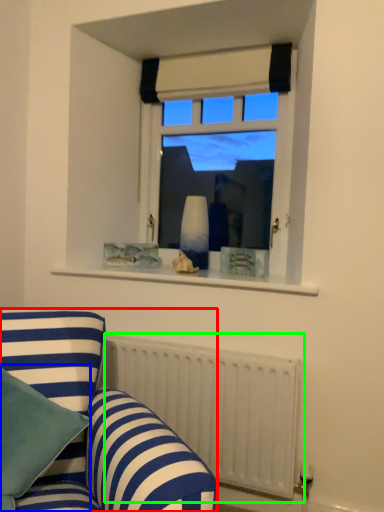
Question: Based on their relative distances, which object is farther from studio couch (highlighted by a red box)? Choose from pillow (highlighted by a blue box) and radiator (highlighted by a green box).

Choices:
 (A) pillow
 (B) radiator

Answer: (B)